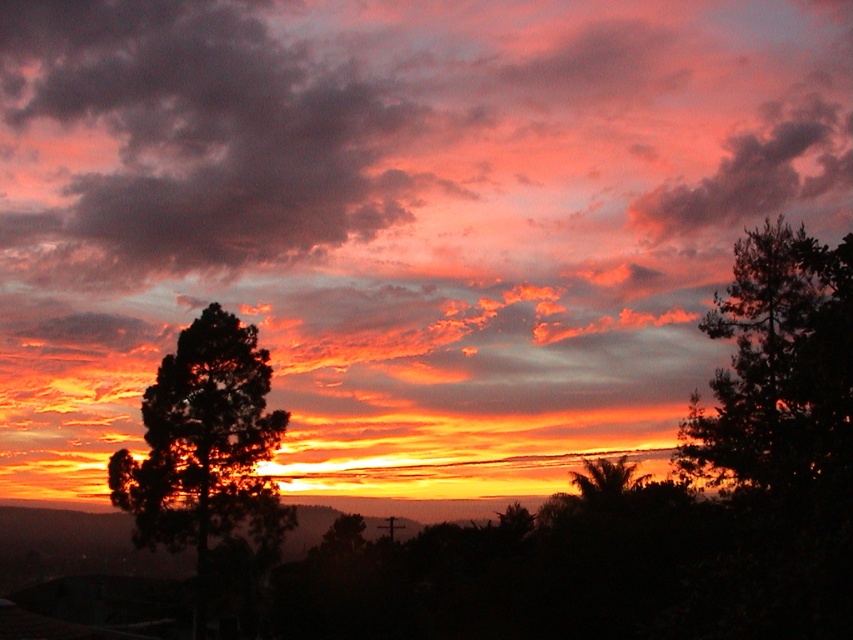
You are an artist trying to paint the sunset scene. You notice the dark green leafy tree at left and the matte pink cloud at upper right. Which object is positioned lower in the image?

The dark green leafy tree at left is positioned lower in the image than the matte pink cloud at upper right.

You are an artist trying to paint the sunset scene. You need to place the dark green leafy tree at left and the matte pink cloud at upper right accurately. Which object should be placed first if you want to follow the standard painting technique of starting with background elements?

The matte pink cloud at upper right should be placed first because it is part of the background, while the dark green leafy tree at left is in the foreground and closer to the viewer.

You are an artist trying to paint the sunset scene. You notice two clouds in the sky, the dark pink cotton clouds at upper center and the matte pink cloud at upper right. Which cloud do you think you should paint wider to stay true to the scene?

The dark pink cotton clouds at upper center should be painted wider because its width surpasses the matte pink cloud at upper right.